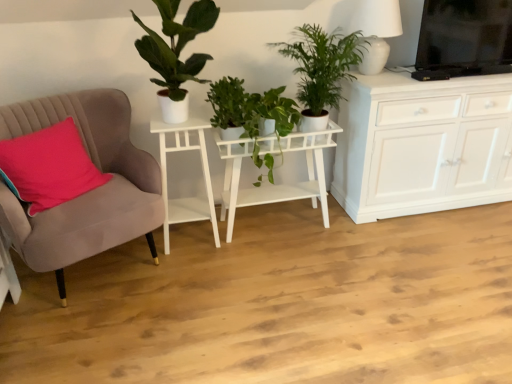
Identify the location of free spot in front of white matte plant stand at center, the 2th table from the left. The image size is (512, 384). (280, 271).